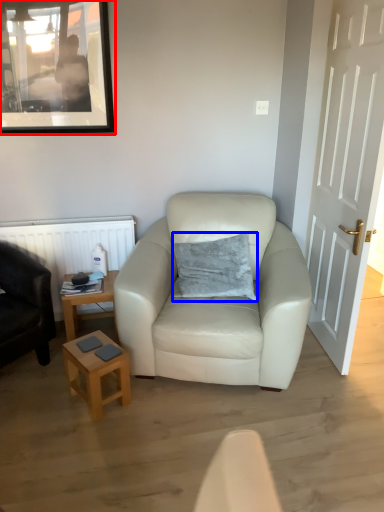
Question: Among these objects, which one is farthest to the camera, picture frame (highlighted by a red box) or pillow (highlighted by a blue box)?

Choices:
 (A) picture frame
 (B) pillow

Answer: (A)